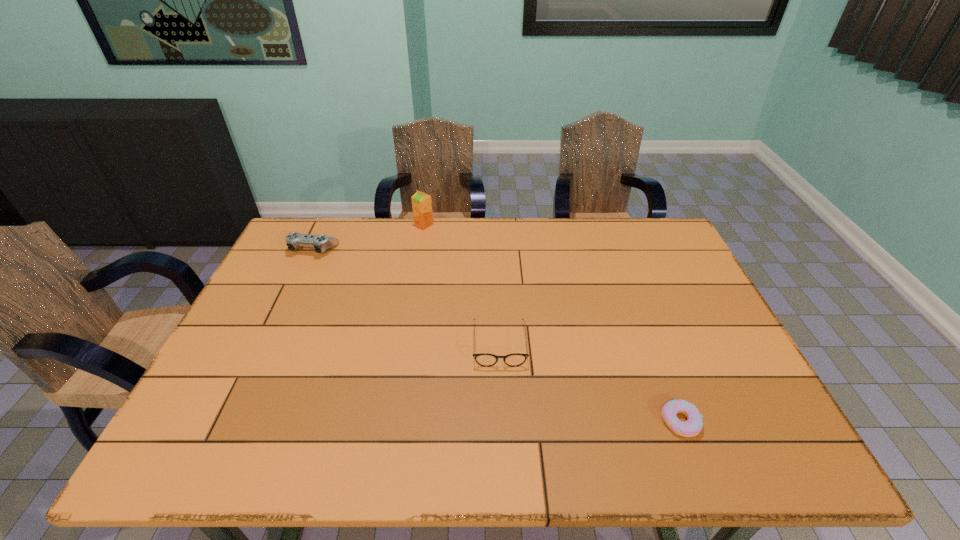
The height and width of the screenshot is (540, 960). In order to click on free space between the second farthest object and the spectacles in this screenshot , I will do `click(406, 296)`.

This screenshot has width=960, height=540. I want to click on free space that is in between the third object from right to left and the rightmost object, so click(552, 323).

Identify the location of free area in between the tallest object and the nearest object. (552, 323).

Select which object is the second closest to the doughnut. Please provide its 2D coordinates. Your answer should be formatted as a tuple, i.e. [(x, y)], where the tuple contains the x and y coordinates of a point satisfying the conditions above.

[(421, 202)]

Select which object appears as the closest to the rightmost object. Please provide its 2D coordinates. Your answer should be formatted as a tuple, i.e. [(x, y)], where the tuple contains the x and y coordinates of a point satisfying the conditions above.

[(484, 359)]

You are a GUI agent. You are given a task and a screenshot of the screen. Output one action in this format:
    pyautogui.click(x=<x>, y=<y>)
    Task: Click on the vacant area in the image that satisfies the following two spatial constraints: 1. on the front side of the third nearest object; 2. on the left side of the shortest object
    Image resolution: width=960 pixels, height=540 pixels.
    Given the screenshot: What is the action you would take?
    pyautogui.click(x=233, y=421)

Find the location of a particular element. The height and width of the screenshot is (540, 960). vacant space that satisfies the following two spatial constraints: 1. through the lenses of the spectacles; 2. on the right side of the nearest object is located at coordinates pos(503,421).

At what (x,y) coordinates should I click in order to perform the action: click on free spot that satisfies the following two spatial constraints: 1. on the back side of the third object from right to left; 2. on the right side of the control. Please return your answer as a coordinate pair (x, y). Looking at the image, I should click on (x=324, y=225).